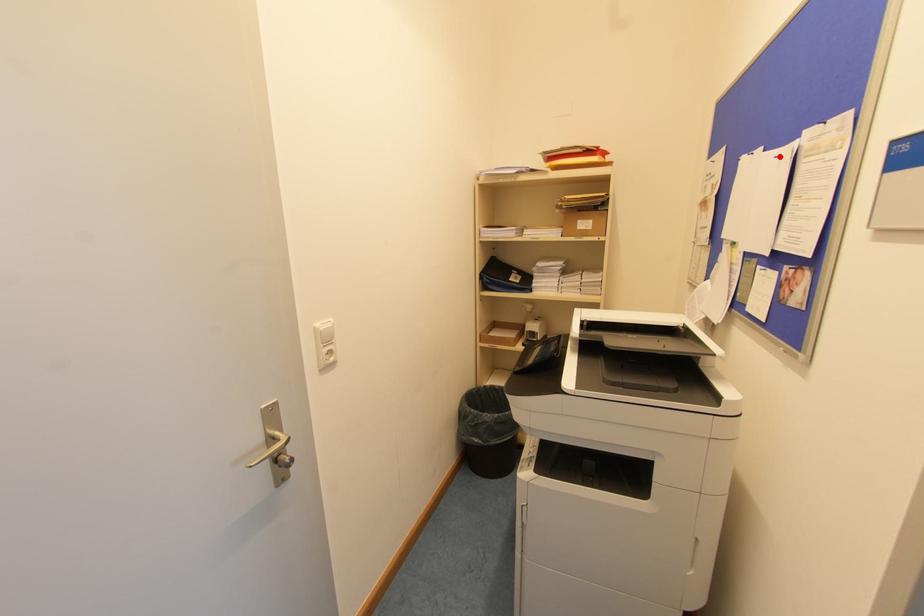
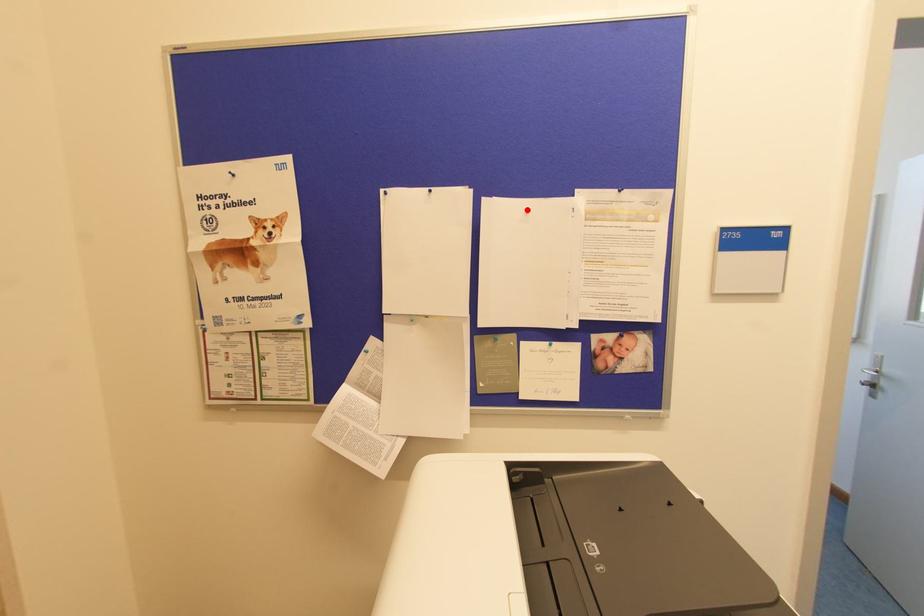
Looking at this image, I am providing you with two images of the same scene from different viewpoints. A red point is marked on the first image and another point is marked on the second image. Is the red point in image1 aligned with the point shown in image2?

Yes